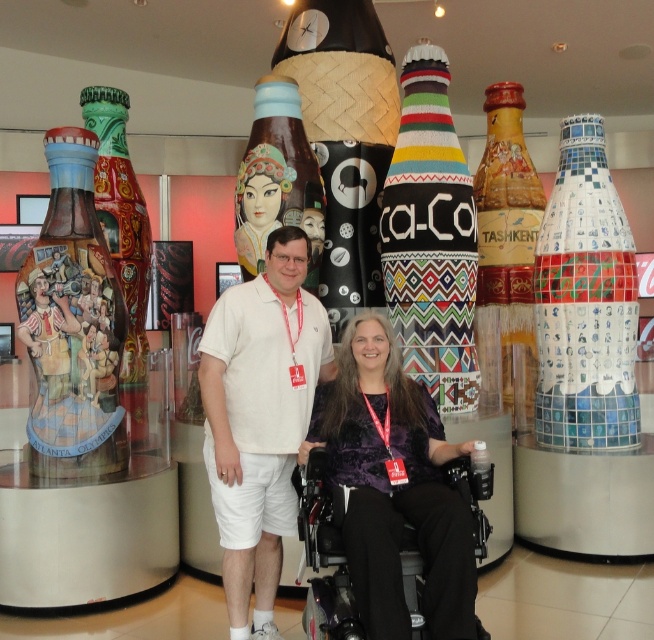
You are a photographer trying to capture both the white cotton polo shirt at center and the mosaic glass bottle at right in a single shot. Which object should you focus on first to ensure proper depth of field?

The white cotton polo shirt at center is thinner than the mosaic glass bottle at right, so you should focus on the mosaic glass bottle at right first since it has a larger size and depth, ensuring better clarity for both objects in the photo.

You are a tour guide leading a group through the Coca Cola exhibit. You need to ensure that all visitors can safely navigate around the display. Given that the black plastic wheelchair at center is behind the matte black bottle at center, can the wheelchair user move forward without hitting the bottle?

The black plastic wheelchair at center is behind the matte black bottle at center, so the wheelchair user can move forward safely without hitting the bottle since the bottle is in front of them.

You are a photographer trying to capture a clear shot of the matte gold bottle at center without any obstructions. Given that the white cotton polo shirt at center is blocking part of the bottle, can you adjust your position to take the photo?

The white cotton polo shirt at center is in front of the matte gold bottle at center, so moving to the side or behind the shirt could allow an unobstructed view of the bottle.